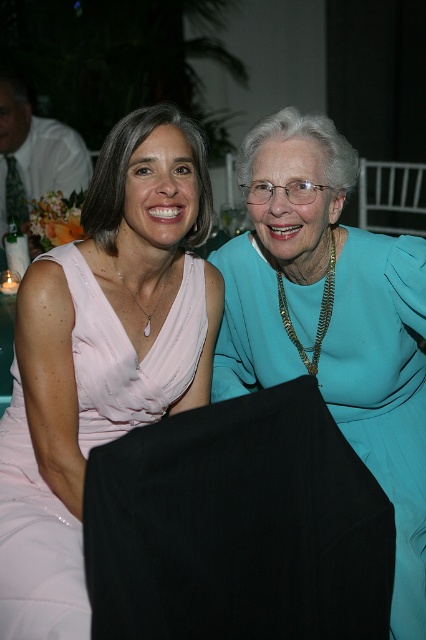
You are a photographer at a wedding reception. You need to arrange the two women so that their dresses are visible in the photo. The teal satin dress at center and the satin pink dress at center are both in the frame. Which dress should you focus on to ensure it appears taller in the photo?

A: The teal satin dress at center is taller than the satin pink dress at center, so focusing on the teal satin dress at center will ensure it appears taller in the photo.

You are a photographer at a wedding reception. You need to adjust the seating arrangement so that the two women in the teal satin dress at center and the satin pink dress at center can sit side by side without their dresses overlapping. Given the space available is 1.2 meters wide, will their combined dress widths fit within this space?

The teal satin dress at center is wider than the satin pink dress at center. Since the combined width of both dresses must be less than or equal to 1.2 meters to fit, but without specific measurements, it cannot be determined if they will fit. However, since the teal dress is wider, it occupies more space, so the total width may exceed the available space. Further information on exact dress widths is needed.